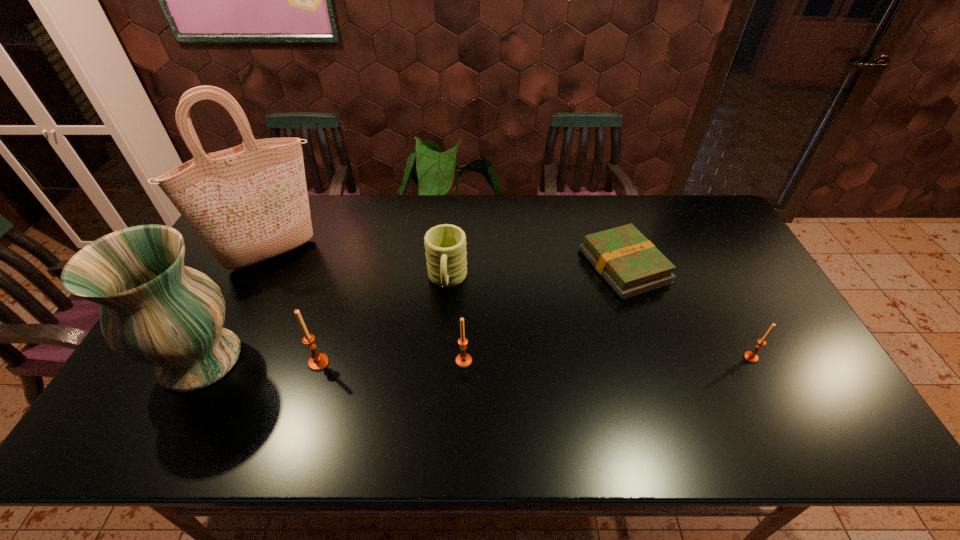
The height and width of the screenshot is (540, 960). I want to click on vacant position for inserting another candle_holder evenly, so click(608, 359).